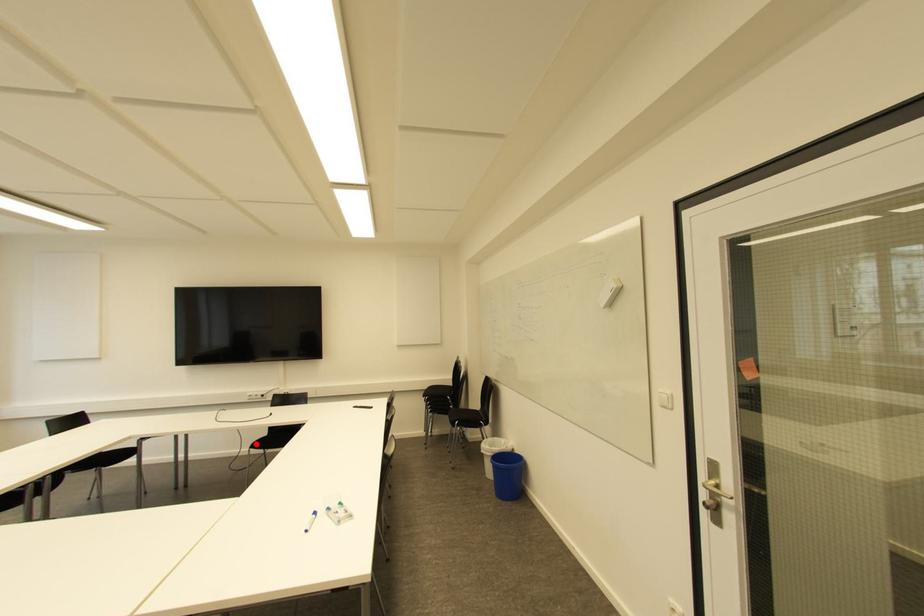
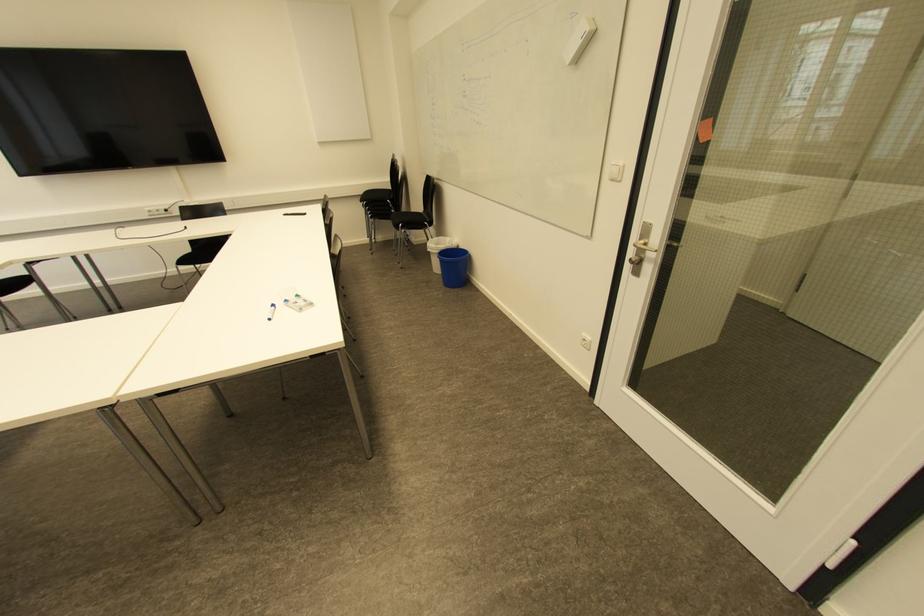
Question: I am providing you with two images of the same scene from different viewpoints. Image1 has a red point marked. In image2, the corresponding 3D location appears at what relative position? Reply with the corresponding letter.

Choices:
 (A) Closer
 (B) Farther

Answer: (A)